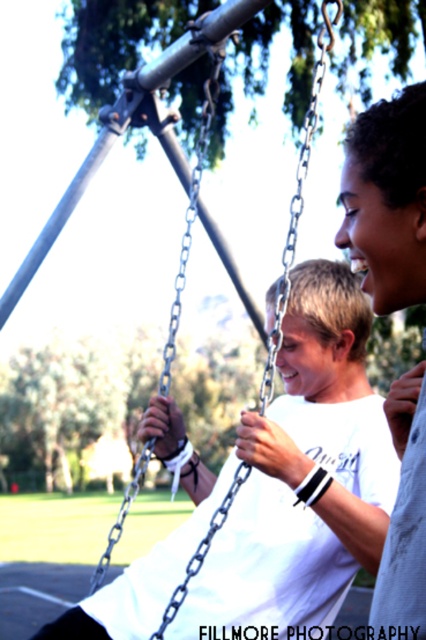
In the scene shown: Between white cotton shirt at center and metallic chain swing at center, which one has more height?

metallic chain swing at center

Can you confirm if white cotton shirt at center is positioned to the right of metallic chain swing at center?

Indeed, white cotton shirt at center is positioned on the right side of metallic chain swing at center.

Does point (356, 544) come closer to viewer compared to point (314, 90)?

Yes, point (356, 544) is in front of point (314, 90).

Identify the location of white cotton shirt at center. The image size is (426, 640). (270, 490).